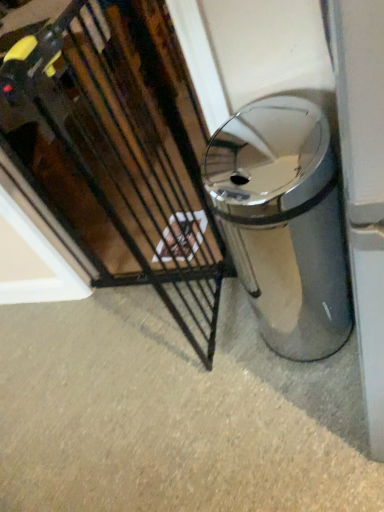
Question: Is point (96, 13) positioned closer to the camera than point (276, 169)?

Choices:
 (A) closer
 (B) farther

Answer: (B)

Question: In terms of height, does black metal gate at center look taller or shorter compared to polished stainless steel trash can at center?

Choices:
 (A) tall
 (B) short

Answer: (A)

Question: In terms of size, does black metal gate at center appear bigger or smaller than polished stainless steel trash can at center?

Choices:
 (A) small
 (B) big

Answer: (B)

Question: Based on their sizes in the image, would you say polished stainless steel trash can at center is bigger or smaller than black metal gate at center?

Choices:
 (A) big
 (B) small

Answer: (B)

Question: Considering the positions of polished stainless steel trash can at center and black metal gate at center in the image, is polished stainless steel trash can at center wider or thinner than black metal gate at center?

Choices:
 (A) thin
 (B) wide

Answer: (B)

Question: From the image's perspective, is polished stainless steel trash can at center above or below black metal gate at center?

Choices:
 (A) above
 (B) below

Answer: (B)

Question: Would you say polished stainless steel trash can at center is to the left or to the right of black metal gate at center in the picture?

Choices:
 (A) right
 (B) left

Answer: (A)